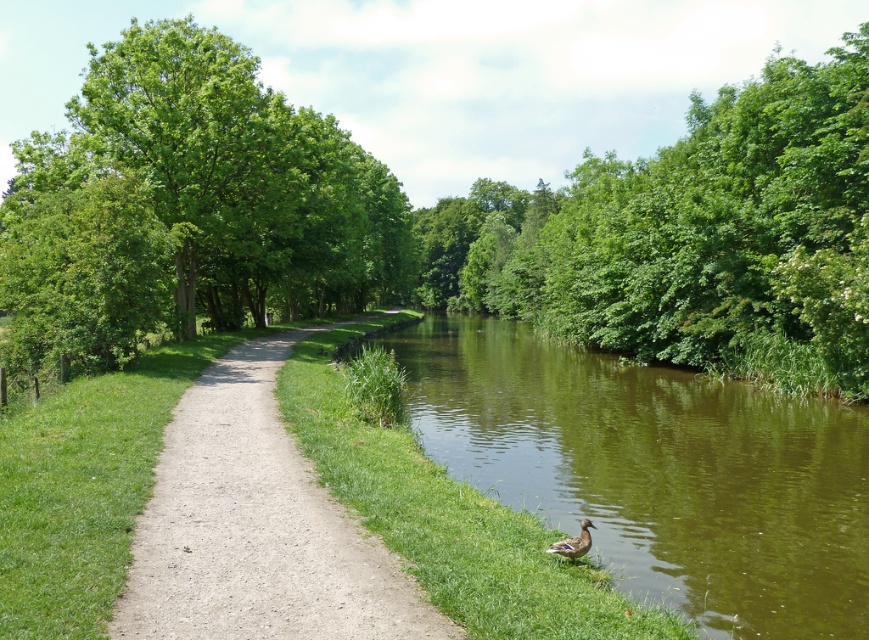
You are planning to walk along the path on the left side of the canal and want to know if the green leafy trees at center are wider than the green grassy river at center. Can you confirm this based on the scene?

The green leafy trees at center are wider than the green grassy river at center according to the description.

You are standing at the edge of the green grassy river at center and want to walk to the dirt path at center. Which direction should you move to reach it?

The dirt path at center is closer to you than the green grassy river at center. To reach the dirt path at center, you should move forward towards it since it is nearer to your current position.

You are a small toy boat that is 0.3 meters wide. You want to sail across the green grassy river at center. Can you safely pass through the area near the brown fuzzy duck at lower center without capsizing?

The green grassy river at center might be wider than brown fuzzy duck at lower center, so there is sufficient space for the toy boat to pass safely as long as the width of the river is more than 0.3 meters.